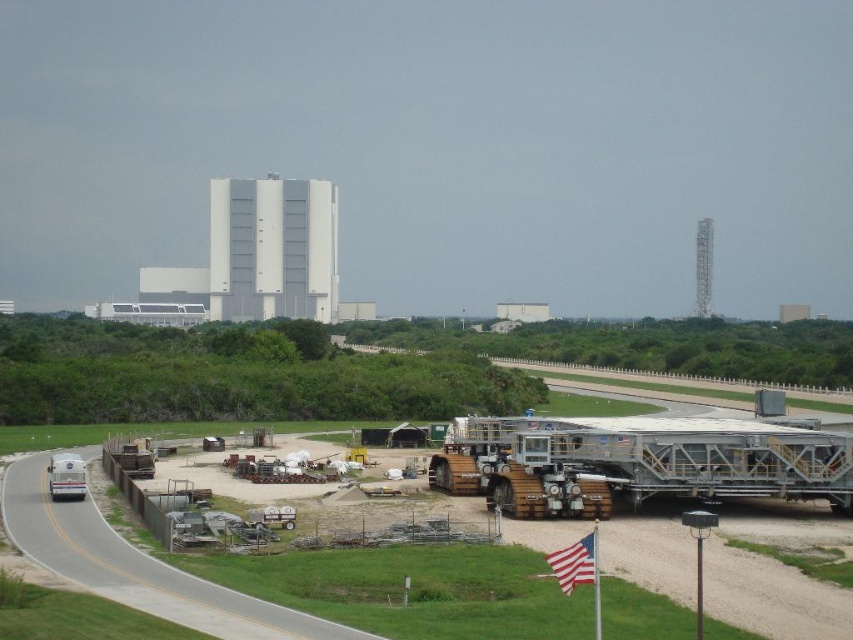
Which is in front, point (628, 538) or point (689, 442)?

Point (628, 538) is more forward.

Identify the location of metallic gray construction equipment at lower center. (x=131, y=563).

Image resolution: width=853 pixels, height=640 pixels. What do you see at coordinates (131, 563) in the screenshot?
I see `metallic gray construction equipment at lower center` at bounding box center [131, 563].

Image resolution: width=853 pixels, height=640 pixels. In order to click on metallic gray construction equipment at lower center in this screenshot , I will do coord(131,563).

Does point (805, 452) come in front of point (53, 557)?

No, it is not.

Is metallic gray trailer truck at center right taller than gray asphalt highway at lower left?

Indeed, metallic gray trailer truck at center right has a greater height compared to gray asphalt highway at lower left.

Between point (585, 428) and point (91, 588), which one is positioned behind?

The point (585, 428) is behind.

This screenshot has width=853, height=640. Find the location of `metallic gray trailer truck at center right`. metallic gray trailer truck at center right is located at coordinates (636, 461).

Can you confirm if metallic gray construction equipment at lower center is shorter than gray asphalt highway at lower left?

No, metallic gray construction equipment at lower center is not shorter than gray asphalt highway at lower left.

Describe the element at coordinates (131, 563) in the screenshot. I see `metallic gray construction equipment at lower center` at that location.

The image size is (853, 640). Identify the location of metallic gray construction equipment at lower center. (131, 563).